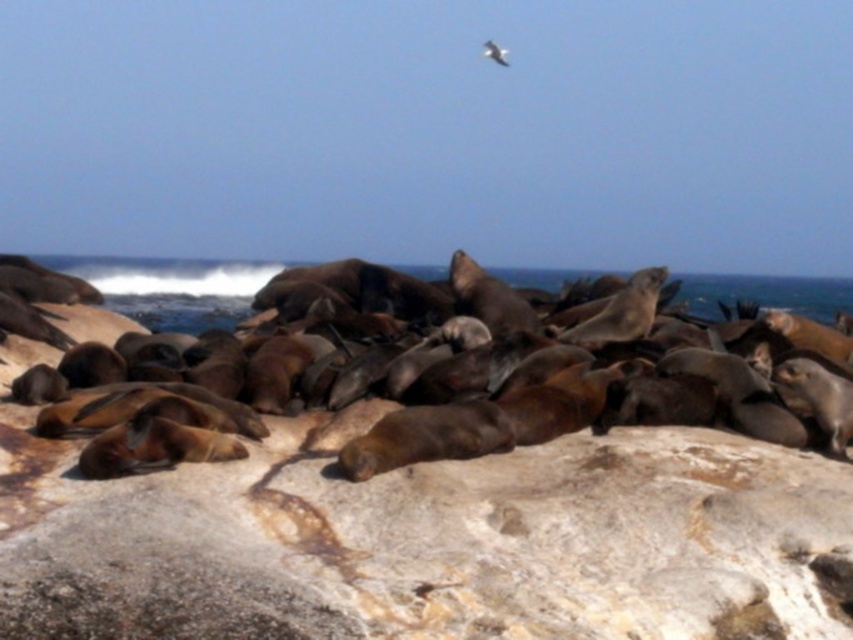
Question: Which object is farther from the camera taking this photo?

Choices:
 (A) white feathered bird at upper center
 (B) brown fur seals at center

Answer: (A)

Question: Can you confirm if brown rough rock at center is positioned above white feathered bird at upper center?

Choices:
 (A) yes
 (B) no

Answer: (B)

Question: Is the position of brown fur seals at center more distant than that of white feathered bird at upper center?

Choices:
 (A) no
 (B) yes

Answer: (A)

Question: Which object is farther from the camera taking this photo?

Choices:
 (A) brown rough rock at center
 (B) white feathered bird at upper center
 (C) brown fur seals at center

Answer: (B)

Question: Which of the following is the farthest from the observer?

Choices:
 (A) brown rough rock at center
 (B) brown fur seals at center

Answer: (B)

Question: Does brown rough rock at center appear over white feathered bird at upper center?

Choices:
 (A) no
 (B) yes

Answer: (A)